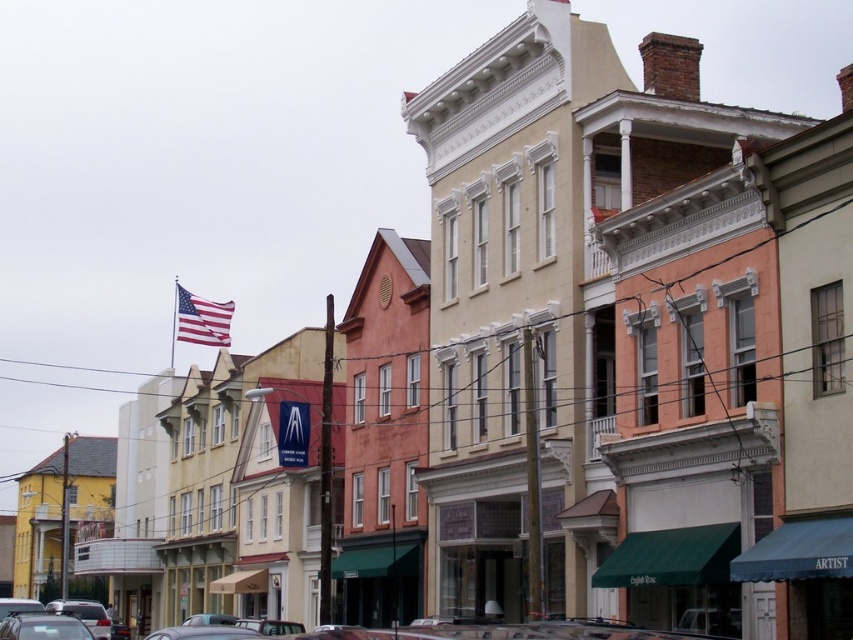
You are a tourist standing on the sidewalk and see the metallic silver car at lower center and the american flag at upper center. Which object is positioned more to the right side of the street?

The metallic silver car at lower center is positioned more to the right side of the street compared to the american flag at upper center.

You are a photographer standing on the sidewalk in front of the historic buildings. You want to take a photo of the american flag at upper center without the metallic silver car at lower center blocking the view. Is the flag visible above the car?

The metallic silver car at lower center is much taller than the american flag at upper center, so the flag would be blocked by the car and not visible in the photo.